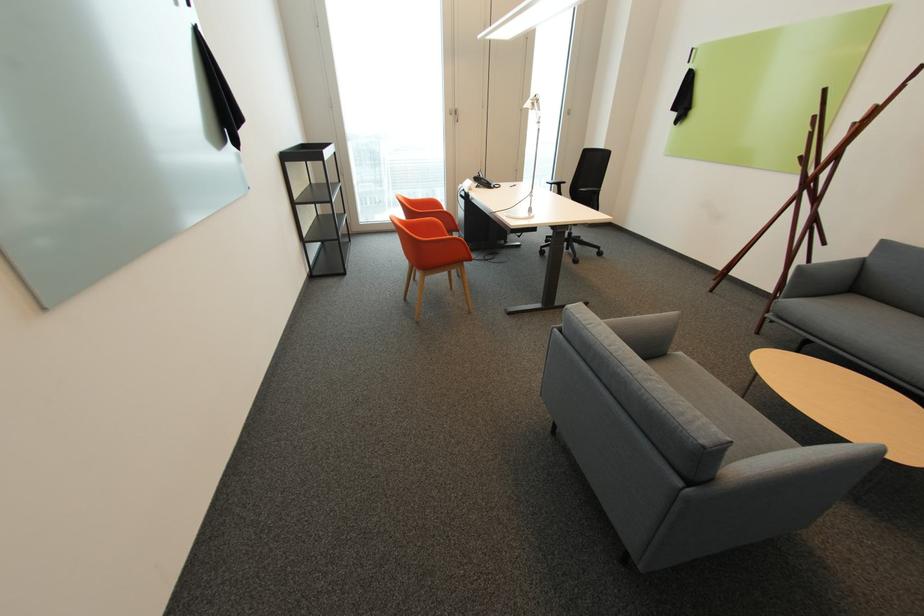
This screenshot has height=616, width=924. What do you see at coordinates (453, 114) in the screenshot? I see `the white window handle` at bounding box center [453, 114].